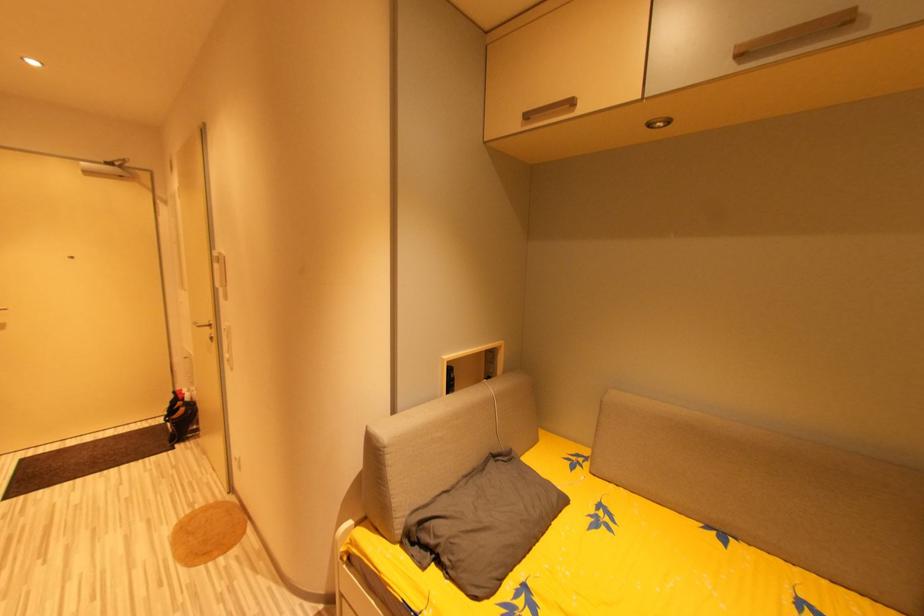
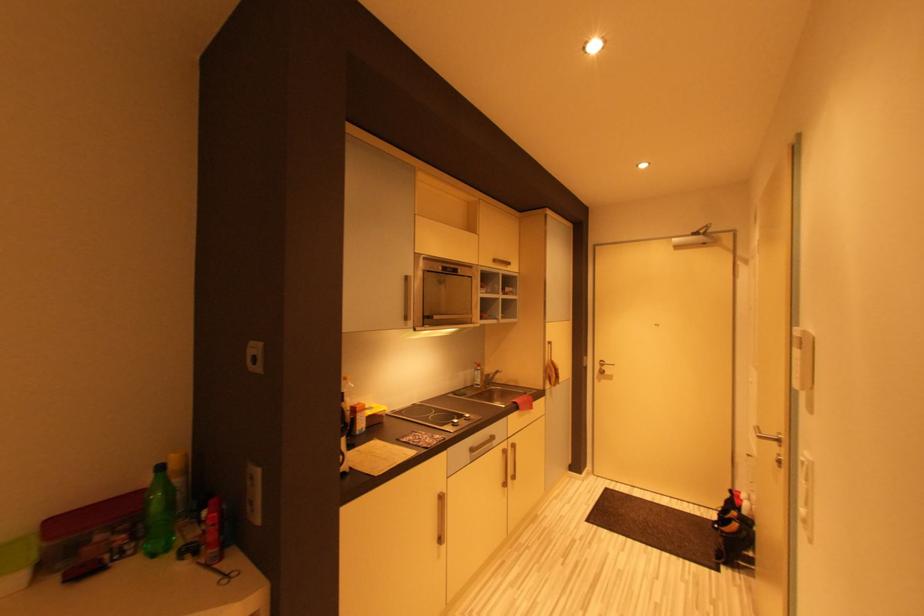
Question: Based on the continuous images, in which direction is the camera rotating? Reply with the corresponding letter.

Choices:
 (A) Left
 (B) Right
 (C) Up
 (D) Down

Answer: (A)